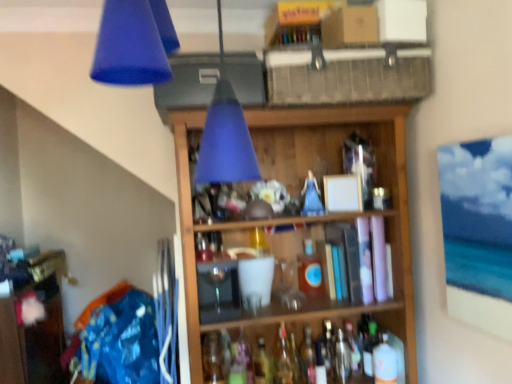
The image size is (512, 384). In order to click on translucent glass bottle at center, the second bottle when ordered from left to right in this screenshot , I will do [x=283, y=359].

Measure the distance between point (332, 367) and camera.

Point (332, 367) and camera are 1.77 meters apart from each other.

I want to click on translucent glass wine bottle at center, the 1th wine bottle positioned from the right, so click(x=353, y=349).

Looking at this image, what is the approximate width of translucent glass wine bottle at center, the 1th wine bottle viewed from the left?

3.61 inches.

Identify the location of translucent glass wine bottle at center, the 1th wine bottle viewed from the left. Image resolution: width=512 pixels, height=384 pixels. (262, 364).

Identify the location of matte blue cone at upper center. Image resolution: width=512 pixels, height=384 pixels. (129, 46).

From the image's perspective, is translucent glass bottle at center, placed as the 5th bottle when sorted from right to left, above or below translucent glass bottle at center, the third bottle viewed from the right?

Clearly, from the image's perspective, translucent glass bottle at center, placed as the 5th bottle when sorted from right to left, is above translucent glass bottle at center, the third bottle viewed from the right.

In the scene shown: Is translucent glass bottle at center, the second bottle when ordered from left to right, not within translucent glass bottle at center, which is counted as the fourth bottle, starting from the left?

Yes, translucent glass bottle at center, the second bottle when ordered from left to right, is located beyond the bounds of translucent glass bottle at center, which is counted as the fourth bottle, starting from the left.

Considering the sizes of translucent glass bottle at center, placed as the 5th bottle when sorted from right to left, and translucent glass bottle at center, which is counted as the fourth bottle, starting from the left, in the image, is translucent glass bottle at center, placed as the 5th bottle when sorted from right to left, bigger or smaller than translucent glass bottle at center, which is counted as the fourth bottle, starting from the left,?

In the image, translucent glass bottle at center, placed as the 5th bottle when sorted from right to left, appears to be larger than translucent glass bottle at center, which is counted as the fourth bottle, starting from the left.

Considering the sizes of translucent glass wine bottle at center, which is counted as the fourth wine bottle, starting from the left, and matte blue cone at upper center in the image, is translucent glass wine bottle at center, which is counted as the fourth wine bottle, starting from the left, taller or shorter than matte blue cone at upper center?

translucent glass wine bottle at center, which is counted as the fourth wine bottle, starting from the left, is shorter than matte blue cone at upper center.

From a real-world perspective, which is physically below, translucent glass wine bottle at center, the 1th wine bottle positioned from the right, or matte blue cone at upper center?

From a 3D spatial view, translucent glass wine bottle at center, the 1th wine bottle positioned from the right, is below.

Does point (352, 332) come in front of point (159, 75)?

That is False.

Which object is positioned more to the right, translucent glass wine bottle at center, which is counted as the fourth wine bottle, starting from the left, or matte blue cone at upper center?

From the viewer's perspective, translucent glass wine bottle at center, which is counted as the fourth wine bottle, starting from the left, appears more on the right side.

Considering the relative sizes of translucent glass bottle at center, which is counted as the 3th bottle, starting from the left, and translucent glass bottle at center, placed as the 5th bottle when sorted from right to left, in the image provided, is translucent glass bottle at center, which is counted as the 3th bottle, starting from the left, taller than translucent glass bottle at center, placed as the 5th bottle when sorted from right to left,?

In fact, translucent glass bottle at center, which is counted as the 3th bottle, starting from the left, may be shorter than translucent glass bottle at center, placed as the 5th bottle when sorted from right to left.

Does point (311, 295) lie in front of point (287, 346)?

Yes, point (311, 295) is closer to viewer.

Who is smaller, translucent glass bottle at center, which is counted as the 3th bottle, starting from the left, or translucent glass bottle at center, placed as the 5th bottle when sorted from right to left?

Smaller between the two is translucent glass bottle at center, which is counted as the 3th bottle, starting from the left.

Is the surface of translucent glass bottle at center, which is counted as the 3th bottle, starting from the left, in direct contact with translucent glass bottle at center, the second bottle when ordered from left to right?

No.

Is translucent plastic bottle at center-right, acting as the 2th bottle starting from the right, looking in the opposite direction of translucent glass bottle at center, which is the 1th bottle in left-to-right order?

No, translucent glass bottle at center, which is the 1th bottle in left-to-right order, is not at the back of translucent plastic bottle at center-right, acting as the 2th bottle starting from the right.

Considering the relative sizes of translucent plastic bottle at center-right, acting as the fifth bottle starting from the left, and translucent glass bottle at center, placed as the 6th bottle when sorted from right to left, in the image provided, is translucent plastic bottle at center-right, acting as the fifth bottle starting from the left, wider than translucent glass bottle at center, placed as the 6th bottle when sorted from right to left,?

Indeed, translucent plastic bottle at center-right, acting as the fifth bottle starting from the left, has a greater width compared to translucent glass bottle at center, placed as the 6th bottle when sorted from right to left.

The width and height of the screenshot is (512, 384). I want to click on the 4th bottle counting from the left of the translucent plastic bottle at center-right, acting as the 2th bottle starting from the right, so click(x=213, y=358).

Would you say translucent plastic bottle at center-right, acting as the 2th bottle starting from the right, is outside translucent glass bottle at center, placed as the 6th bottle when sorted from right to left?

Yes, translucent plastic bottle at center-right, acting as the 2th bottle starting from the right, is outside of translucent glass bottle at center, placed as the 6th bottle when sorted from right to left.

Is wooden shelf at center thinner than translucent glass wine bottle at center, which appears as the 4th wine bottle when viewed from the right?

In fact, wooden shelf at center might be wider than translucent glass wine bottle at center, which appears as the 4th wine bottle when viewed from the right.

Is wooden shelf at center smaller than translucent glass wine bottle at center, the 1th wine bottle viewed from the left?

Incorrect, wooden shelf at center is not smaller in size than translucent glass wine bottle at center, the 1th wine bottle viewed from the left.

Is wooden shelf at center at the right side of translucent glass wine bottle at center, the 1th wine bottle viewed from the left?

Yes.

Who is smaller, translucent glass bottle at center, placed as the 5th bottle when sorted from right to left, or translucent glass bottle at center, which is the 1th bottle in left-to-right order?

Smaller between the two is translucent glass bottle at center, placed as the 5th bottle when sorted from right to left.

From the image's perspective, which one is positioned lower, translucent glass bottle at center, placed as the 5th bottle when sorted from right to left, or translucent glass bottle at center, placed as the 6th bottle when sorted from right to left?

translucent glass bottle at center, placed as the 6th bottle when sorted from right to left, is shown below in the image.

Can you confirm if translucent glass bottle at center, placed as the 5th bottle when sorted from right to left, is wider than translucent glass bottle at center, which is the 1th bottle in left-to-right order?

No, translucent glass bottle at center, placed as the 5th bottle when sorted from right to left, is not wider than translucent glass bottle at center, which is the 1th bottle in left-to-right order.

Considering the relative sizes of translucent glass bottle at center, the second bottle when ordered from left to right, and translucent glass bottle at center, placed as the 6th bottle when sorted from right to left, in the image provided, is translucent glass bottle at center, the second bottle when ordered from left to right, shorter than translucent glass bottle at center, placed as the 6th bottle when sorted from right to left,?

In fact, translucent glass bottle at center, the second bottle when ordered from left to right, may be taller than translucent glass bottle at center, placed as the 6th bottle when sorted from right to left.

What's the angular difference between translucent glass wine bottle at center, marked as the third wine bottle in a right-to-left arrangement, and translucent glass bottle at center, the second bottle when ordered from left to right,'s facing directions?

5.17 degrees separate the facing orientations of translucent glass wine bottle at center, marked as the third wine bottle in a right-to-left arrangement, and translucent glass bottle at center, the second bottle when ordered from left to right.

Is translucent glass wine bottle at center, marked as the third wine bottle in a right-to-left arrangement, taller or shorter than translucent glass bottle at center, the second bottle when ordered from left to right?

Answer: In the image, translucent glass wine bottle at center, marked as the third wine bottle in a right-to-left arrangement, appears to be shorter than translucent glass bottle at center, the second bottle when ordered from left to right.

From a real-world perspective, is translucent glass wine bottle at center, marked as the third wine bottle in a right-to-left arrangement, physically below translucent glass bottle at center, placed as the 5th bottle when sorted from right to left?

Yes, from a real-world perspective, translucent glass wine bottle at center, marked as the third wine bottle in a right-to-left arrangement, is below translucent glass bottle at center, placed as the 5th bottle when sorted from right to left.

Image resolution: width=512 pixels, height=384 pixels. I want to click on the 3rd bottle in front when counting from the translucent glass bottle at center, which is counted as the fourth bottle, starting from the left, so click(x=283, y=359).

There is a matte blue cone at upper center. Find the location of `the 2nd wine bottle below it (from a real-world perspective)`. the 2nd wine bottle below it (from a real-world perspective) is located at coordinates (353, 349).

When comparing their distances from translucent glass wine bottle at center, the 1th wine bottle positioned from the right, does translucent glass bottle at center, the third bottle viewed from the right, or translucent glass bottle at center, placed as the 5th bottle when sorted from right to left, seem closer?

translucent glass bottle at center, the third bottle viewed from the right.

Looking at the image, which one is located further to translucent glass wine bottle at center, the 3th wine bottle viewed from the left, translucent glass wine bottle at center, the 1th wine bottle positioned from the right, or translucent plastic bottle at lower right, the sixth bottle viewed from the left?

translucent plastic bottle at lower right, the sixth bottle viewed from the left, is further to translucent glass wine bottle at center, the 3th wine bottle viewed from the left.

From the image, which object appears to be farther from translucent plastic bottle at center-right, acting as the 2th bottle starting from the right, translucent glass bottle at center, the third bottle viewed from the right, or matte blue cone at upper center?

Based on the image, matte blue cone at upper center appears to be further to translucent plastic bottle at center-right, acting as the 2th bottle starting from the right.

When comparing their distances from translucent plastic bottle at center-right, acting as the fifth bottle starting from the left, does translucent glass bottle at center, placed as the 5th bottle when sorted from right to left, or translucent glass wine bottle at center, which is counted as the fourth wine bottle, starting from the left, seem further?

Among the two, translucent glass bottle at center, placed as the 5th bottle when sorted from right to left, is located further to translucent plastic bottle at center-right, acting as the fifth bottle starting from the left.

Considering their positions, is translucent glass wine bottle at center, which appears as the 4th wine bottle when viewed from the right, positioned closer to translucent glass bottle at center, placed as the 5th bottle when sorted from right to left, than wooden shelf at center?

translucent glass wine bottle at center, which appears as the 4th wine bottle when viewed from the right, is positioned closer to the anchor translucent glass bottle at center, placed as the 5th bottle when sorted from right to left.

Consider the image. Looking at the image, which one is located closer to translucent glass wine bottle at center, marked as the third wine bottle in a right-to-left arrangement, translucent glass wine bottle at center, the 1th wine bottle viewed from the left, or wooden shelf at center?

translucent glass wine bottle at center, the 1th wine bottle viewed from the left.

Considering their positions, is translucent glass wine bottle at center, the 3th wine bottle viewed from the left, positioned closer to wooden shelf at center than translucent glass bottle at center, placed as the 5th bottle when sorted from right to left?

Based on the image, translucent glass wine bottle at center, the 3th wine bottle viewed from the left, appears to be nearer to wooden shelf at center.

Based on their spatial positions, is translucent glass bottle at center, which is counted as the fourth bottle, starting from the left, or wooden shelf at center closer to translucent glass wine bottle at center, the 1th wine bottle viewed from the left?

translucent glass bottle at center, which is counted as the fourth bottle, starting from the left, is closer to translucent glass wine bottle at center, the 1th wine bottle viewed from the left.

Find the location of a particular element. The image size is (512, 384). bottle located between translucent glass wine bottle at center, acting as the 2th wine bottle starting from the right, and translucent plastic bottle at lower right, the sixth bottle viewed from the left, in the left-right direction is located at coordinates (370, 349).

Where is `bottle between translucent glass wine bottle at center, marked as the third wine bottle in a right-to-left arrangement, and translucent glass wine bottle at center, the 1th wine bottle positioned from the right`? The width and height of the screenshot is (512, 384). bottle between translucent glass wine bottle at center, marked as the third wine bottle in a right-to-left arrangement, and translucent glass wine bottle at center, the 1th wine bottle positioned from the right is located at coordinates (326, 351).

Locate an element on the screen. shelf between translucent glass wine bottle at center, which appears as the 4th wine bottle when viewed from the right, and translucent plastic bottle at lower right, the 1th bottle in the right-to-left sequence, from left to right is located at coordinates (380, 179).

You are a GUI agent. You are given a task and a screenshot of the screen. Output one action in this format:
    pyautogui.click(x=<x>, y=<y>)
    Task: Click on the shelf between matte blue cone at upper center and translucent glass bottle at center, the third bottle viewed from the right, from front to back
    
    Given the screenshot: What is the action you would take?
    pyautogui.click(x=380, y=179)